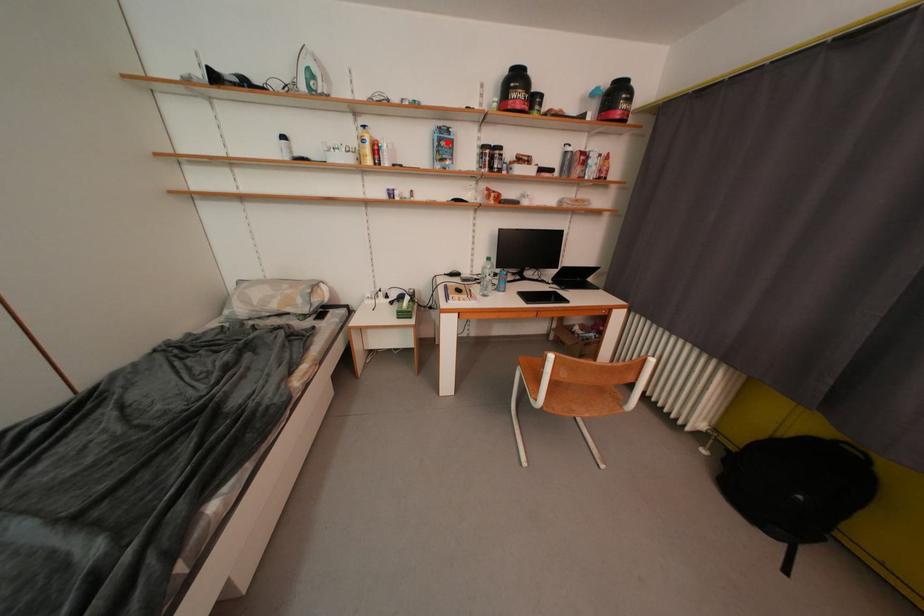
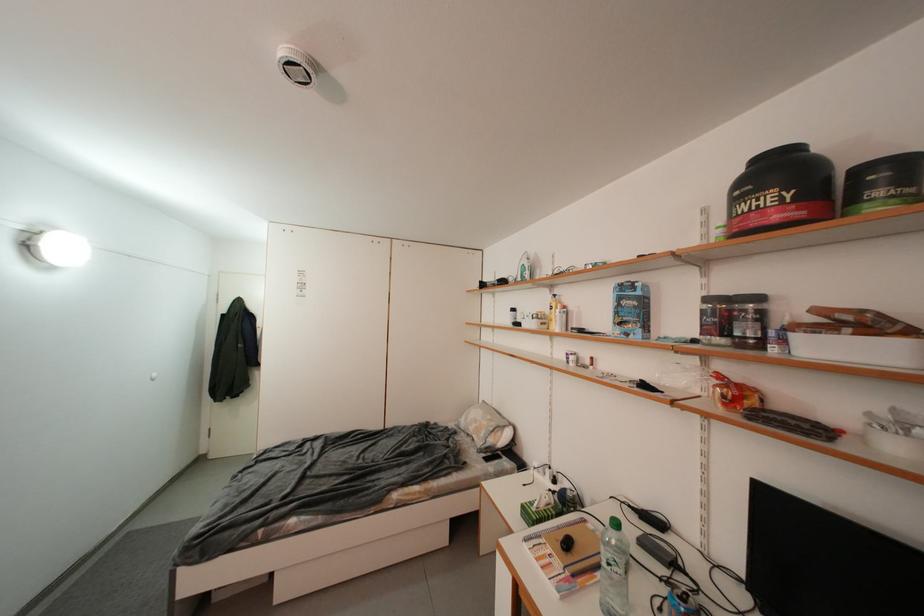
Question: I am providing you with two images of the same scene from different viewpoints. Given a red point in image1, look at the same physical point in image2. Is it:

Choices:
 (A) Closer to the viewpoint
 (B) Farther from the viewpoint

Answer: (B)